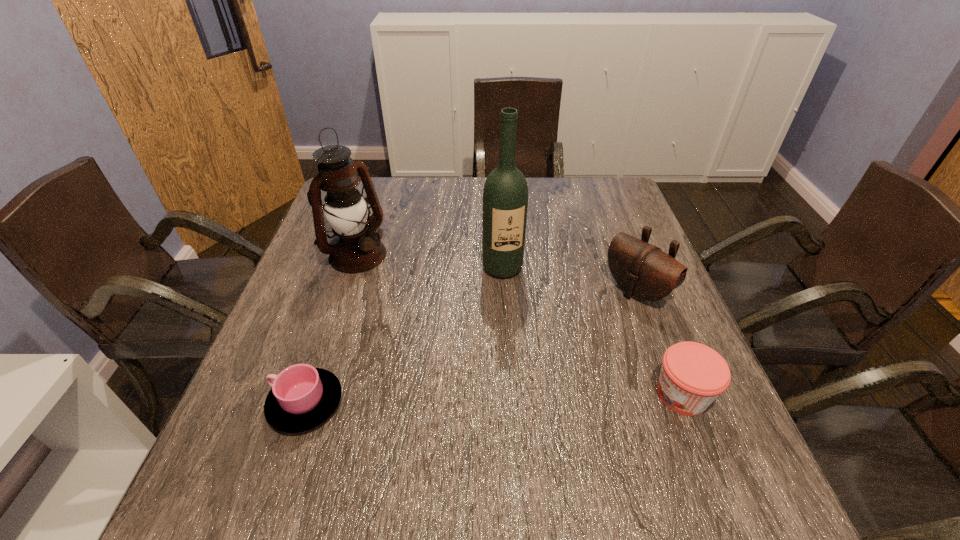
Identify the location of free space located on the side of the fourth shortest object, there is a wick adjustment knob. This screenshot has height=540, width=960. (401, 288).

The image size is (960, 540). Find the location of `vacant space situated 0.210m on the labeled side of the third object from right to left`. vacant space situated 0.210m on the labeled side of the third object from right to left is located at coordinates (528, 346).

You are a GUI agent. You are given a task and a screenshot of the screen. Output one action in this format:
    pyautogui.click(x=<x>, y=<y>)
    Task: Click on the vacant area located 0.340m on the labeled side of the third object from right to left
    
    Given the screenshot: What is the action you would take?
    pyautogui.click(x=544, y=397)

The image size is (960, 540). I want to click on vacant space situated on the labeled side of the third object from right to left, so click(518, 316).

What are the coordinates of `free point located 0.240m with the flap open on the pouch` in the screenshot? It's located at tap(548, 360).

The width and height of the screenshot is (960, 540). What are the coordinates of `vacant space positioned 0.350m with the flap open on the pouch` in the screenshot? It's located at (510, 388).

This screenshot has width=960, height=540. Find the location of `free space located 0.350m with the flap open on the pouch`. free space located 0.350m with the flap open on the pouch is located at coordinates (510, 388).

The width and height of the screenshot is (960, 540). I want to click on cup present at the near edge, so click(302, 397).

Image resolution: width=960 pixels, height=540 pixels. Identify the location of jam that is positioned at the near edge. (693, 375).

Identify the location of cup present at the left edge. [x=302, y=397].